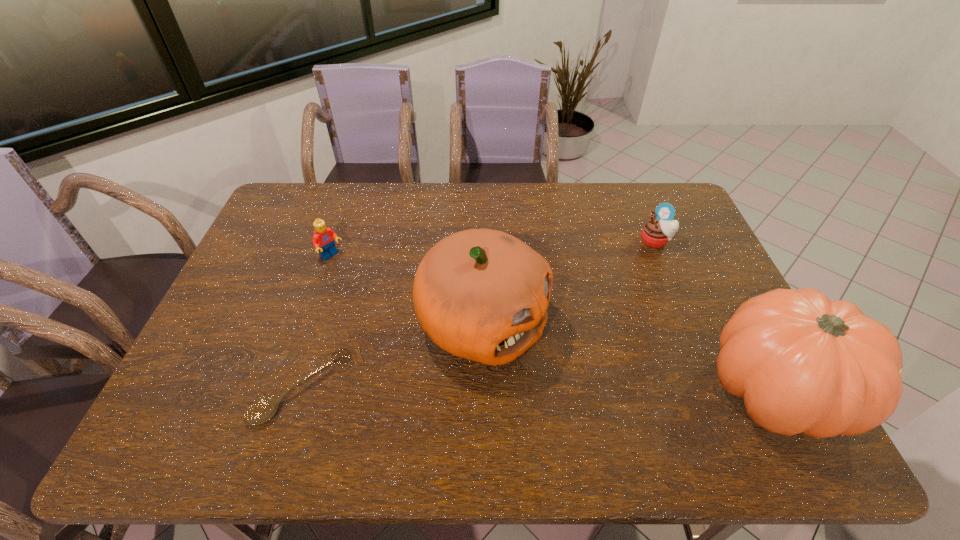
What are the coordinates of `free space located on the face of the third object from right to left` in the screenshot? It's located at (594, 382).

The image size is (960, 540). Identify the location of vacant region located 0.190m on the face of the third object from right to left. (610, 390).

I want to click on vacant space situated 0.360m on the front-facing side of the muffin, so click(592, 315).

Identify the location of free space located 0.400m on the front-facing side of the muffin. This screenshot has height=540, width=960. (585, 323).

The image size is (960, 540). I want to click on free point located on the front-facing side of the muffin, so click(x=629, y=272).

Where is `ladle that is at the near edge`? The height and width of the screenshot is (540, 960). ladle that is at the near edge is located at coordinates (x=261, y=411).

Identify the location of pumpkin that is positioned at the right edge. The height and width of the screenshot is (540, 960). (804, 364).

The height and width of the screenshot is (540, 960). What are the coordinates of `muffin that is at the right edge` in the screenshot? It's located at (656, 232).

At what (x,y) coordinates should I click in order to perform the action: click on object located in the near right corner section of the desktop. Please return your answer as a coordinate pair (x, y). The height and width of the screenshot is (540, 960). Looking at the image, I should click on (804, 364).

Find the location of a particular element. vacant space at the far edge of the desktop is located at coordinates (364, 186).